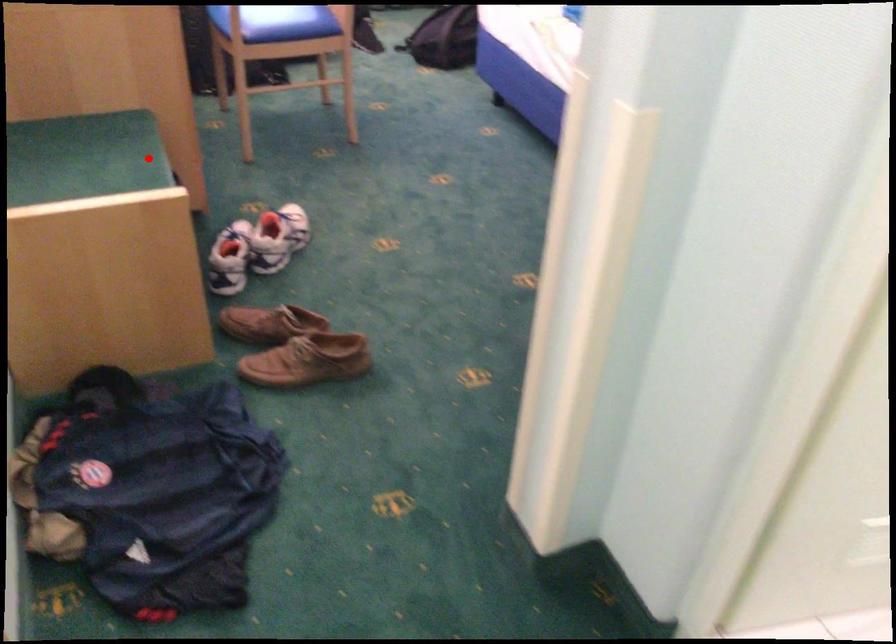
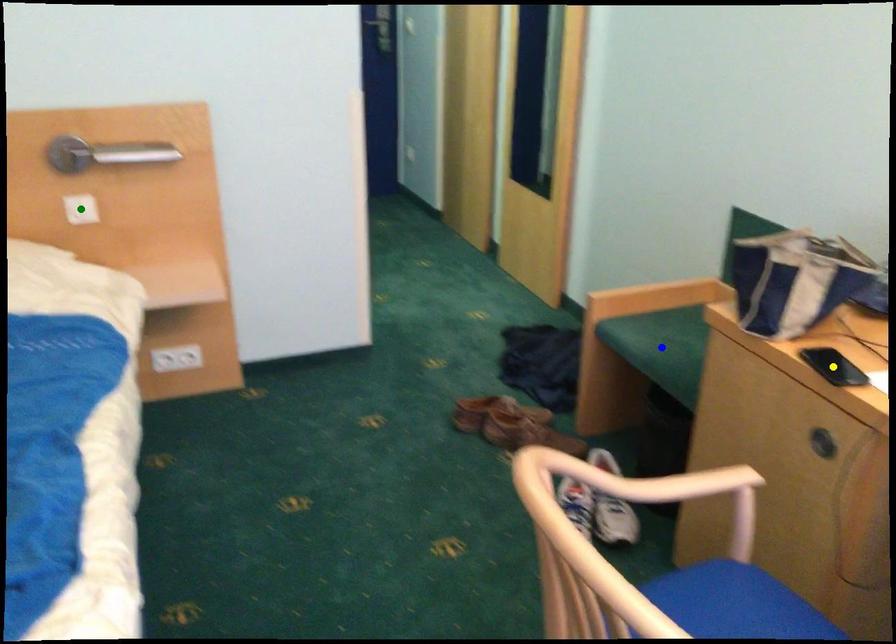
Question: I am providing you with two images of the same scene from different viewpoints. A red point is marked on the first image. You are given multiple points on the second image. In image 2, which mark is for the same physical point as the one in image 1?

Choices:
 (A) blue point
 (B) green point
 (C) yellow point

Answer: (A)